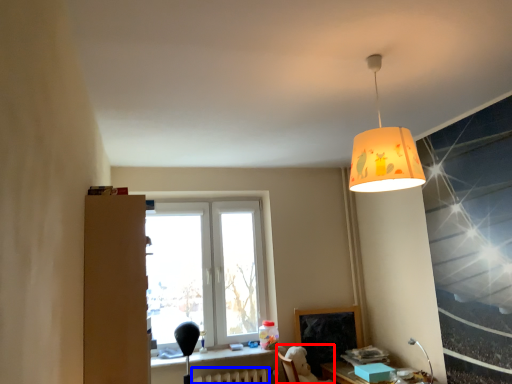
Question: Which point is further to the camera, swivel chair (highlighted by a red box) or radiator (highlighted by a blue box)?

Choices:
 (A) swivel chair
 (B) radiator

Answer: (B)